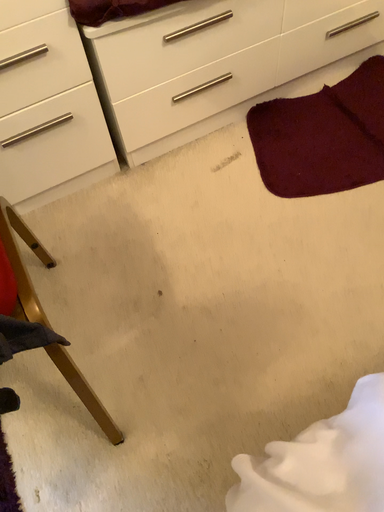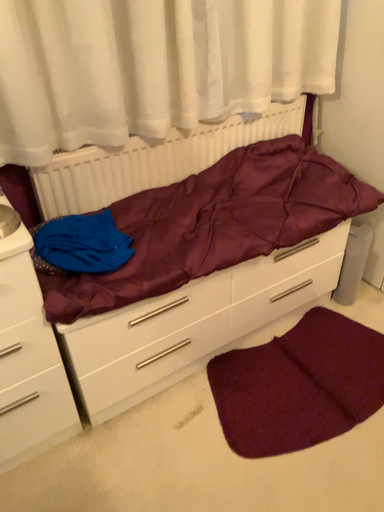
Question: How did the camera likely rotate when shooting the video?

Choices:
 (A) rotated downward
 (B) rotated upward

Answer: (B)